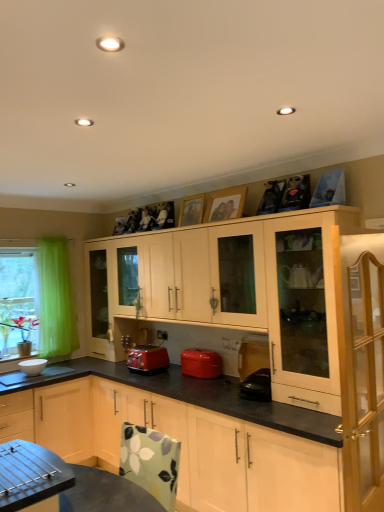
Find the location of a particular element. blank space to the left of matte red toaster at center, placed as the first kitchen appliance when sorted from right to left is located at coordinates (163, 379).